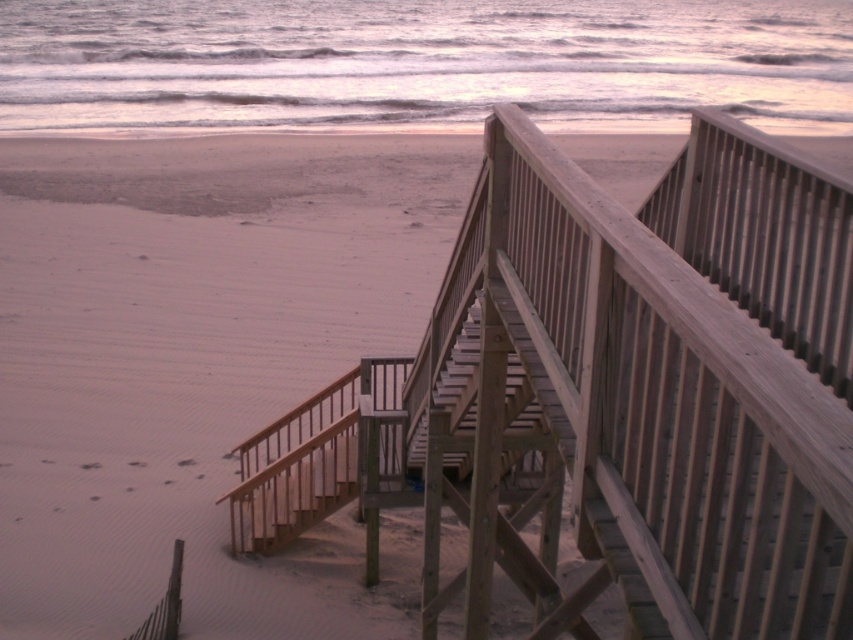
You are standing on the wooden stairs at center and want to walk towards the ocean. Which direction should you go relative to the sandy water at upper center?

You should walk away from the sandy water at upper center because the wooden stairs at center is behind it, meaning the ocean is in front of the sandy water at upper center.

You are standing at the top of the wooden stairs at center and want to walk to the sandy water at upper center. Which direction should you move to reach it?

The sandy water at upper center is wider than the wooden stairs at center, so you should move forward along the wooden stairs at center towards the sandy water at upper center to reach it.

You are standing at the bottom of the wooden staircase and want to reach the ocean. According to the image, where is the sandy water at upper center located in relation to your position?

The sandy water at upper center is located at point 0.100 in the x coordinate and 0.495 in the y coordinate, so it is positioned to the left and slightly below your current position at the bottom of the staircase.